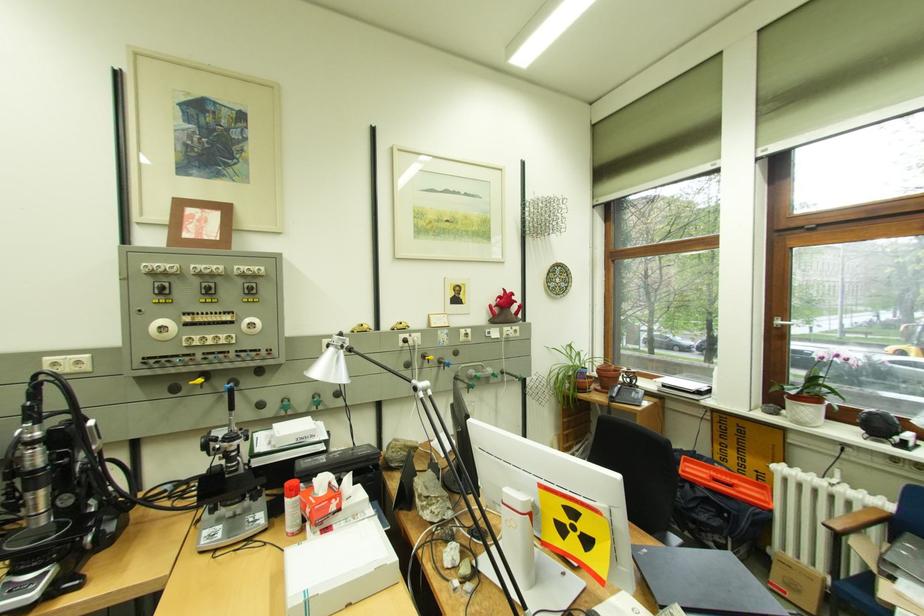
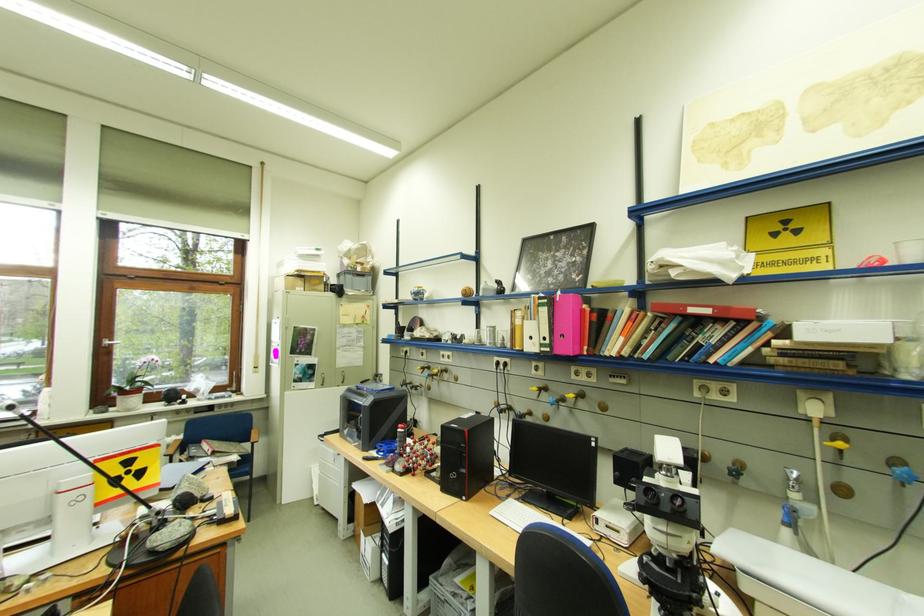
Locate, in the second image, the point that corresponds to (x=788, y=323) in the first image.

(117, 342)